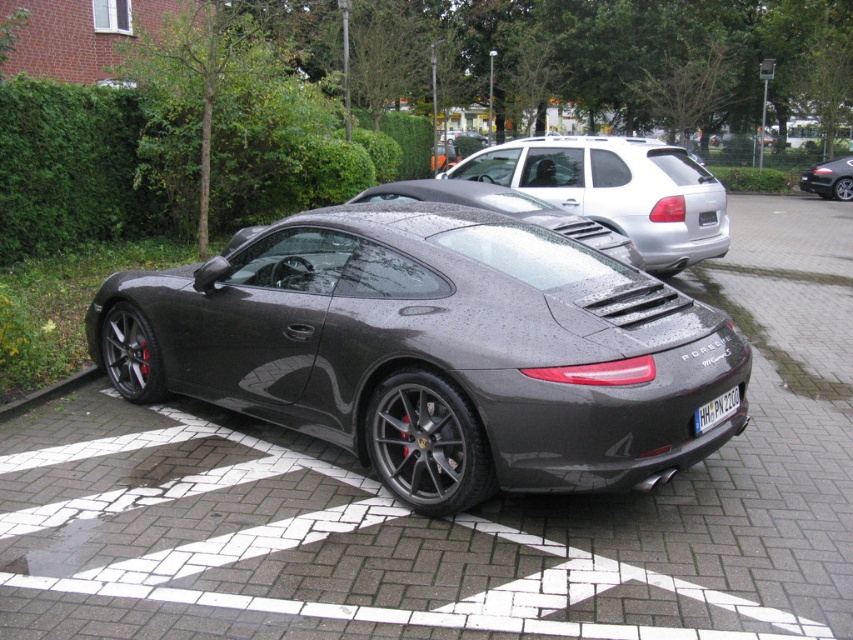
You are a delivery driver who needs to park a delivery van that is 6 feet tall. You see the satin silver metallic suv at upper right and the shiny black car at center in the parking lot. Which parking spot would be suitable for your van based on height restrictions?

The satin silver metallic suv at upper right is taller than the shiny black car at center. Since your van is 6 feet tall, you should choose the parking spot where the shiny black car at center is parked because it has a lower height restriction compared to the satin silver metallic suv at upper right.

You are a parking sensor trying to determine if the Porsche is parked correctly. The parking space has two points marked as reference points. The points are point 1 at (x=689, y=257) and point 2 at (x=61, y=394). According to the parking rules, the car must be positioned so that the front of the car is closer to the camera than the rear. Is the Porsche parked correctly based on the positions of these two points?

Point 1 at (x=689, y=257) is further to the camera than point 2 at (x=61, y=394). Since the front of the car should be closer to the camera than the rear, the Porsche is parked incorrectly because the point further from the camera is labeled as point 1.